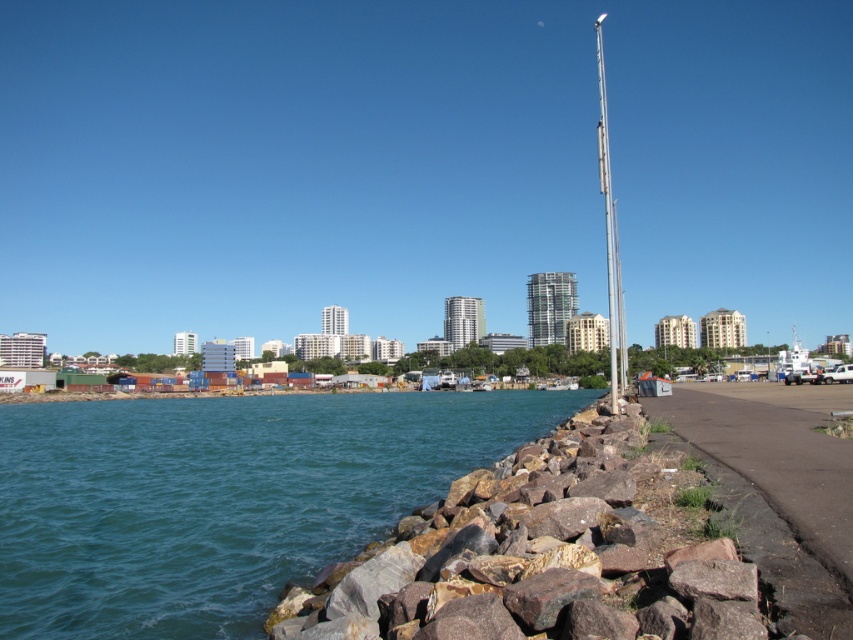
Does rocky at lower right have a lesser width compared to silver metallic flag pole at right?

Indeed, rocky at lower right has a lesser width compared to silver metallic flag pole at right.

Between rocky at lower right and silver metallic flag pole at right, which one is positioned higher?

silver metallic flag pole at right is above.

At what (x,y) coordinates should I click in order to perform the action: click on rocky at lower right. Please return your answer as a coordinate pair (x, y). Looking at the image, I should click on (544, 554).

Image resolution: width=853 pixels, height=640 pixels. Identify the location of rocky at lower right. (544, 554).

You are a GUI agent. You are given a task and a screenshot of the screen. Output one action in this format:
    pyautogui.click(x=<x>, y=<y>)
    Task: Click on the teal rock at lower left
    
    Given the screenshot: What is the action you would take?
    [x=222, y=499]

Who is positioned more to the right, teal rock at lower left or rocky at lower right?

From the viewer's perspective, rocky at lower right appears more on the right side.

Who is more distant from viewer, [67,436] or [490,474]?

The point [67,436] is more distant.

Locate an element on the screen. teal rock at lower left is located at coordinates (222, 499).

Does teal rock at lower left come behind silver metallic flag pole at right?

No, teal rock at lower left is in front of silver metallic flag pole at right.

Who is higher up, teal rock at lower left or silver metallic flag pole at right?

silver metallic flag pole at right

Which is behind, point (299, 561) or point (607, 292)?

Positioned behind is point (607, 292).

Identify the location of teal rock at lower left. (222, 499).